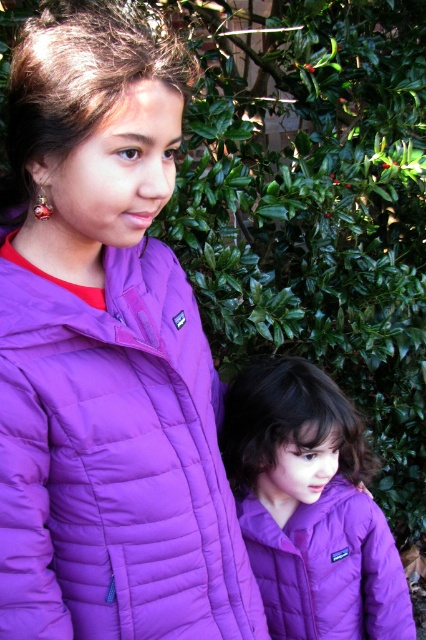
Where is `purple quilted jacket at left`? purple quilted jacket at left is located at coordinates (106, 356).

Which of these two, purple quilted jacket at left or purple quilted jacket at center, stands taller?

Standing taller between the two is purple quilted jacket at left.

Find the location of a particular element. purple quilted jacket at left is located at coordinates (106, 356).

You are a GUI agent. You are given a task and a screenshot of the screen. Output one action in this format:
    pyautogui.click(x=<x>, y=<y>)
    Task: Click on the purple quilted jacket at left
    
    Given the screenshot: What is the action you would take?
    pyautogui.click(x=106, y=356)